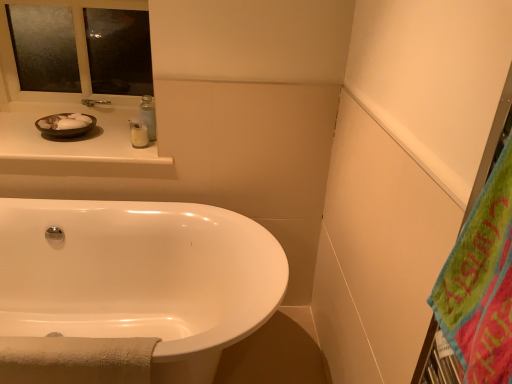
Question: Is matte black bowl at upper left positioned in front of green fuzzy beach towel at right?

Choices:
 (A) yes
 (B) no

Answer: (B)

Question: From a real-world perspective, is matte black bowl at upper left on top of green fuzzy beach towel at right?

Choices:
 (A) yes
 (B) no

Answer: (B)

Question: Considering the relative positions of matte black bowl at upper left and green fuzzy beach towel at right in the image provided, is matte black bowl at upper left to the left of green fuzzy beach towel at right from the viewer's perspective?

Choices:
 (A) no
 (B) yes

Answer: (B)

Question: Does matte black bowl at upper left have a greater width compared to green fuzzy beach towel at right?

Choices:
 (A) yes
 (B) no

Answer: (A)

Question: From a real-world perspective, is matte black bowl at upper left beneath green fuzzy beach towel at right?

Choices:
 (A) no
 (B) yes

Answer: (B)

Question: Is matte black bowl at upper left with green fuzzy beach towel at right?

Choices:
 (A) yes
 (B) no

Answer: (B)

Question: Considering the relative sizes of matte black bowl at upper left and frosted glass mirror at upper left in the image provided, is matte black bowl at upper left bigger than frosted glass mirror at upper left?

Choices:
 (A) yes
 (B) no

Answer: (B)

Question: Can you see matte black bowl at upper left touching frosted glass mirror at upper left?

Choices:
 (A) yes
 (B) no

Answer: (B)

Question: Does matte black bowl at upper left have a lesser height compared to frosted glass mirror at upper left?

Choices:
 (A) no
 (B) yes

Answer: (B)

Question: Is matte black bowl at upper left to the left of frosted glass mirror at upper left from the viewer's perspective?

Choices:
 (A) no
 (B) yes

Answer: (A)

Question: Is matte black bowl at upper left aimed at frosted glass mirror at upper left?

Choices:
 (A) yes
 (B) no

Answer: (B)

Question: Is matte black bowl at upper left positioned beyond the bounds of frosted glass mirror at upper left?

Choices:
 (A) yes
 (B) no

Answer: (A)

Question: Is green fuzzy beach towel at right far away from matte white counter at upper left?

Choices:
 (A) no
 (B) yes

Answer: (B)